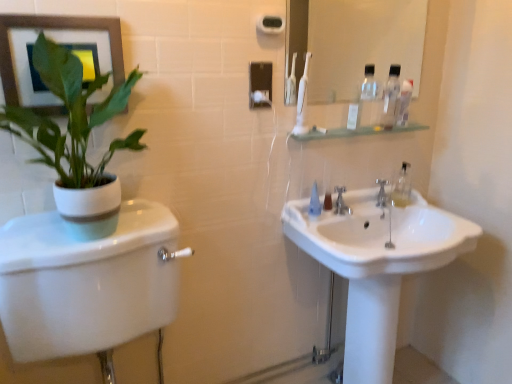
Question: Does clear plastic bottle at upper right appear on the right side of white plastic toothpaste tube at upper center?

Choices:
 (A) yes
 (B) no

Answer: (A)

Question: Is white plastic toothpaste tube at upper center surrounded by clear plastic bottle at upper right?

Choices:
 (A) yes
 (B) no

Answer: (B)

Question: Is clear plastic bottle at upper right further to camera compared to white plastic toothpaste tube at upper center?

Choices:
 (A) no
 (B) yes

Answer: (B)

Question: Would you consider clear plastic bottle at upper right to be distant from white plastic toothpaste tube at upper center?

Choices:
 (A) yes
 (B) no

Answer: (B)

Question: From a real-world perspective, does clear plastic bottle at upper right stand above white plastic toothpaste tube at upper center?

Choices:
 (A) yes
 (B) no

Answer: (A)

Question: From the image's perspective, is clear plastic mouthwash at upper right, which is the 2th mouthwash in left-to-right order, above or below white plastic toothbrush at upper center?

Choices:
 (A) below
 (B) above

Answer: (A)

Question: Is clear plastic mouthwash at upper right, the 2th mouthwash positioned from the front, to the left or to the right of white plastic toothbrush at upper center in the image?

Choices:
 (A) right
 (B) left

Answer: (A)

Question: In terms of width, does clear plastic mouthwash at upper right, the 1th mouthwash positioned from the right, look wider or thinner when compared to white plastic toothbrush at upper center?

Choices:
 (A) thin
 (B) wide

Answer: (B)

Question: From their relative heights in the image, would you say clear plastic mouthwash at upper right, the 1th mouthwash positioned from the right, is taller or shorter than white plastic toothbrush at upper center?

Choices:
 (A) tall
 (B) short

Answer: (B)

Question: Is point (400, 99) positioned closer to the camera than point (20, 253)?

Choices:
 (A) closer
 (B) farther

Answer: (B)

Question: Considering the positions of clear plastic mouthwash at upper right, the 2th mouthwash positioned from the front, and white glossy toilet at left in the image, is clear plastic mouthwash at upper right, the 2th mouthwash positioned from the front, taller or shorter than white glossy toilet at left?

Choices:
 (A) tall
 (B) short

Answer: (B)

Question: Considering the positions of clear plastic mouthwash at upper right, which appears as the first mouthwash when viewed from the back, and white glossy toilet at left in the image, is clear plastic mouthwash at upper right, which appears as the first mouthwash when viewed from the back, bigger or smaller than white glossy toilet at left?

Choices:
 (A) big
 (B) small

Answer: (B)

Question: Is clear plastic mouthwash at upper right, which is the 1th mouthwash from top to bottom, wider or thinner than white glossy toilet at left?

Choices:
 (A) wide
 (B) thin

Answer: (B)

Question: Considering the positions of matte gray picture frame at upper left and white plastic toothpaste tube at upper center in the image, is matte gray picture frame at upper left wider or thinner than white plastic toothpaste tube at upper center?

Choices:
 (A) thin
 (B) wide

Answer: (B)

Question: In terms of size, does matte gray picture frame at upper left appear bigger or smaller than white plastic toothpaste tube at upper center?

Choices:
 (A) small
 (B) big

Answer: (B)